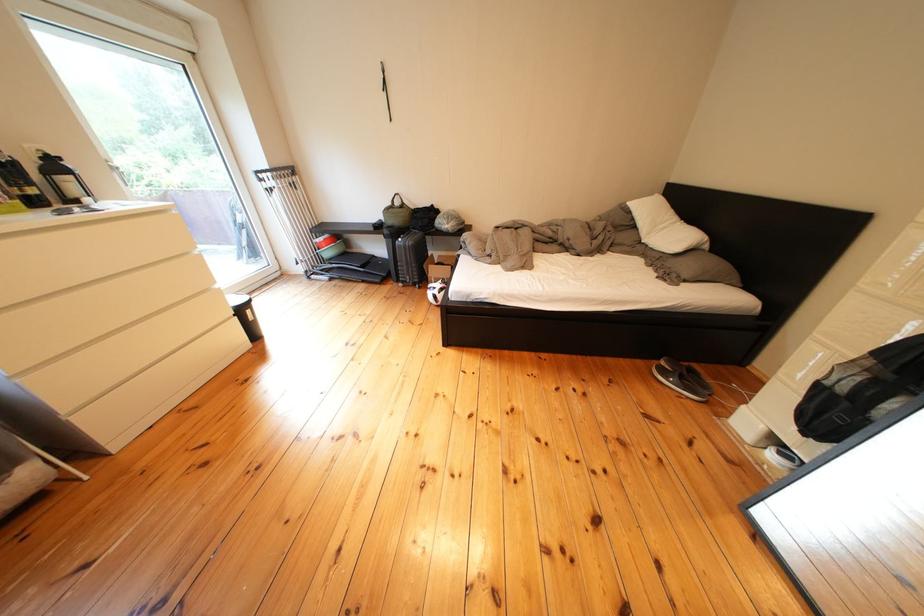
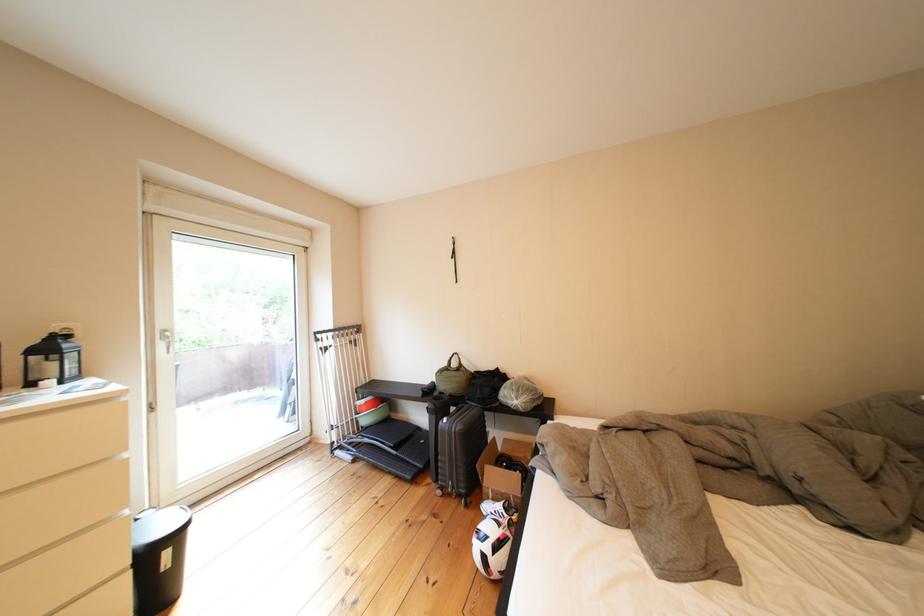
The first image is from the beginning of the video and the second image is from the end. How did the camera likely rotate when shooting the video?

The rotation direction of the camera is left-up.